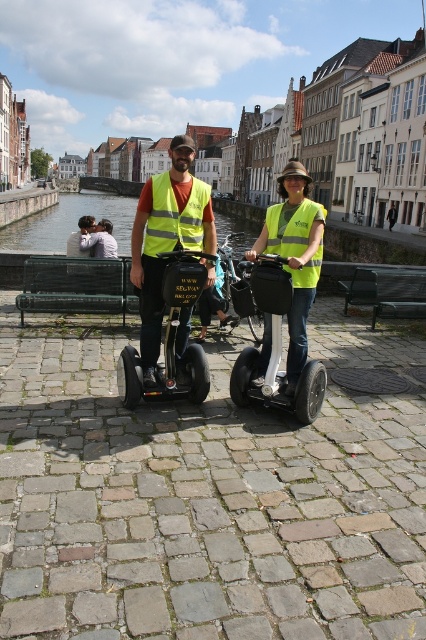
This screenshot has height=640, width=426. What do you see at coordinates (77, 285) in the screenshot?
I see `green metal bench at left` at bounding box center [77, 285].

Who is lower down, green metal bench at left or high-visibility yellow safety vest at center?

green metal bench at left

Identify the location of green metal bench at left. (77, 285).

Can you confirm if yellow reflective vest at center is bigger than black metal park bench at center?

Yes, yellow reflective vest at center is bigger than black metal park bench at center.

Can you confirm if yellow reflective vest at center is positioned to the right of black metal park bench at center?

No, yellow reflective vest at center is not to the right of black metal park bench at center.

I want to click on yellow reflective vest at center, so click(x=294, y=256).

Measure the distance from yellow reflective vest at center to light brown leather bench at center.

They are 10.39 meters apart.

Is yellow reflective vest at center taller than light brown leather bench at center?

Yes, yellow reflective vest at center is taller than light brown leather bench at center.

Which is behind, point (250, 257) or point (75, 244)?

The point (75, 244) is more distant.

Find the location of a particular element. yellow reflective vest at center is located at coordinates (294, 256).